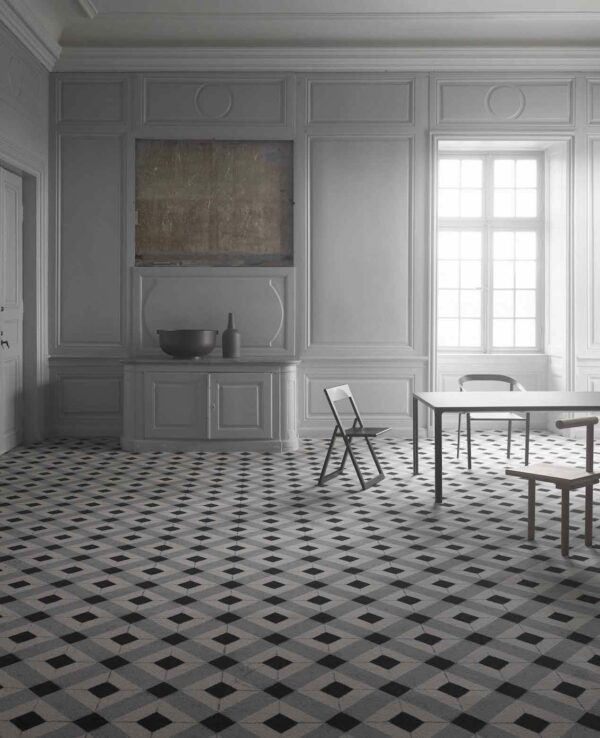
Identify the location of window. (489, 237).